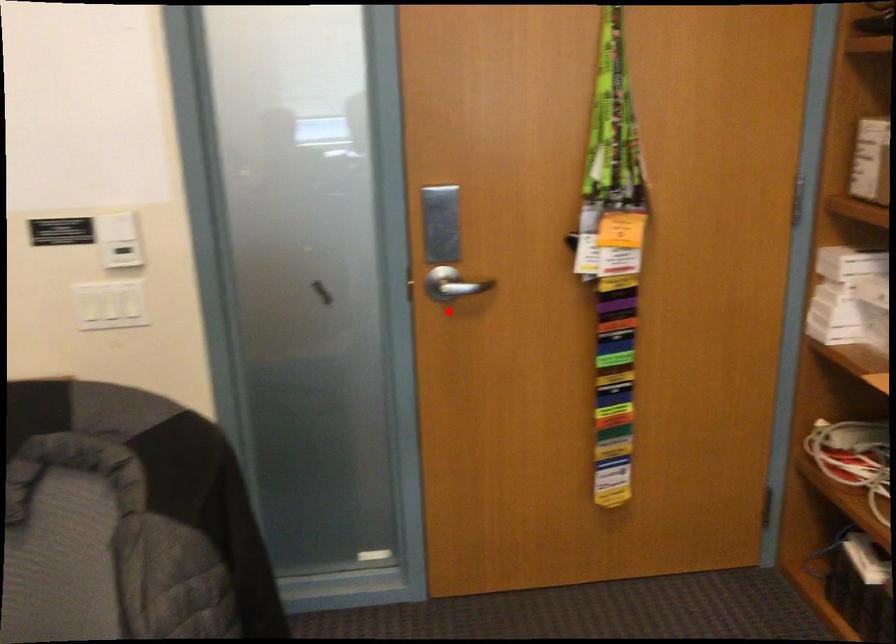
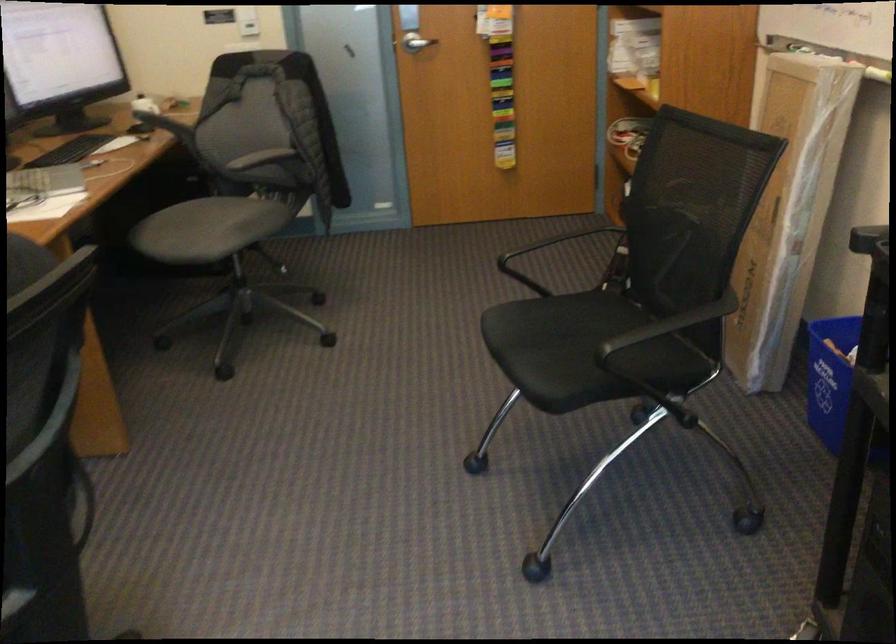
Question: I am providing you with two images of the same scene from different viewpoints. Image1 has a red point marked. In image2, the corresponding 3D location appears at what relative position? Reply with the corresponding letter.

Choices:
 (A) Closer
 (B) Farther

Answer: (B)